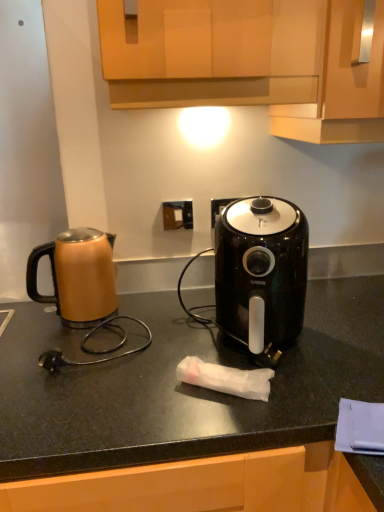
Where is `vacant space to the right of black glossy air fryer at center`? The width and height of the screenshot is (384, 512). vacant space to the right of black glossy air fryer at center is located at coordinates (337, 340).